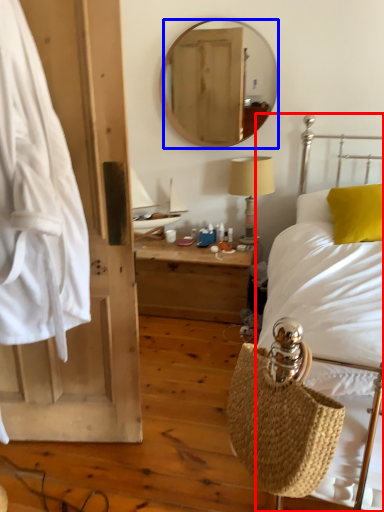
Question: Which object is closer to the camera taking this photo, bed (highlighted by a red box) or mirror (highlighted by a blue box)?

Choices:
 (A) bed
 (B) mirror

Answer: (A)